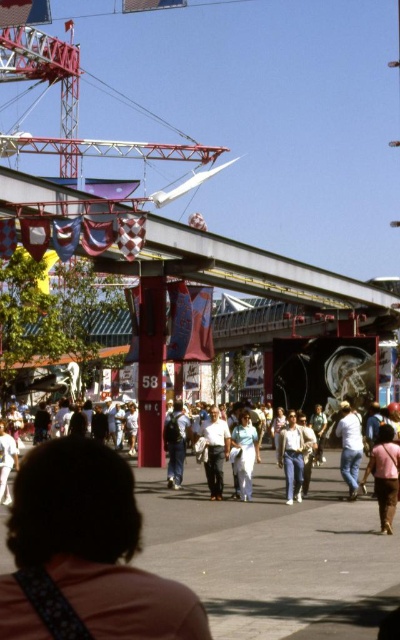
Who is more distant from viewer, (112, 509) or (220, 490)?

Positioned behind is point (220, 490).

Does point (172, 612) come in front of point (222, 438)?

Yes, point (172, 612) is in front of point (222, 438).

This screenshot has width=400, height=640. Describe the element at coordinates (84, 554) in the screenshot. I see `pink fabric shirt at lower center` at that location.

At what (x,y) coordinates should I click in order to perform the action: click on pink fabric shirt at lower center. Please return your answer as a coordinate pair (x, y). Looking at the image, I should click on (84, 554).

Does pink fabric shirt at lower center appear on the left side of pink fabric at center?

Indeed, pink fabric shirt at lower center is positioned on the left side of pink fabric at center.

Where is `pink fabric shirt at lower center`? pink fabric shirt at lower center is located at coordinates (84, 554).

Does pink fabric at center appear under light blue fabric pants at center?

Yes.

The width and height of the screenshot is (400, 640). Identify the location of pink fabric at center. 385,474.